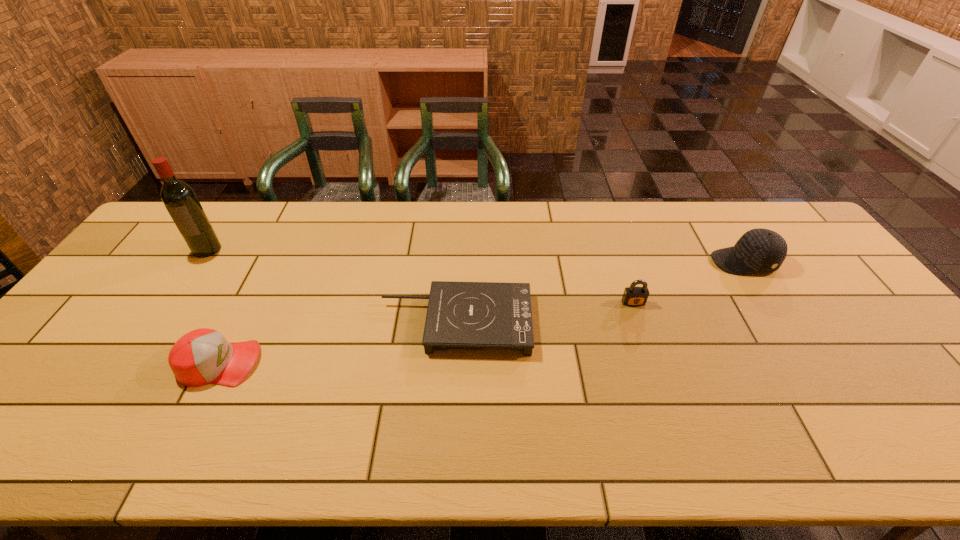
You are a GUI agent. You are given a task and a screenshot of the screen. Output one action in this format:
    pyautogui.click(x=<x>, y=<y>)
    Task: Click on the free space located at the front of the farther baseball cap where the brim is located
    This screenshot has height=540, width=960.
    Given the screenshot: What is the action you would take?
    pyautogui.click(x=588, y=262)

I want to click on vacant area situated at the front of the farther baseball cap where the brim is located, so click(594, 262).

You are a GUI agent. You are given a task and a screenshot of the screen. Output one action in this format:
    pyautogui.click(x=<x>, y=<y>)
    Task: Click on the vacant space located 0.060m at the front of the farther baseball cap where the brim is located
    
    Given the screenshot: What is the action you would take?
    pyautogui.click(x=692, y=262)

Locate an element on the screen. free space located 0.140m on the front of the second object from right to left near the keyhole is located at coordinates (648, 348).

Find the location of a particular element. Image resolution: width=960 pixels, height=540 pixels. vacant space located on the front-facing side of the nearer baseball cap is located at coordinates (348, 363).

The width and height of the screenshot is (960, 540). What are the coordinates of `vacant space positioned on the left of the shortest object` in the screenshot? It's located at (231, 322).

The image size is (960, 540). What are the coordinates of `object that is at the far edge` in the screenshot? It's located at (181, 202).

Locate an element on the screen. The image size is (960, 540). vacant space at the far edge of the desktop is located at coordinates (675, 206).

At what (x,y) coordinates should I click in order to perform the action: click on vacant space at the near edge of the desktop. Please return your answer as a coordinate pair (x, y). Image resolution: width=960 pixels, height=540 pixels. Looking at the image, I should click on (64, 431).

What are the coordinates of `vacant region at the left edge` in the screenshot? It's located at (157, 249).